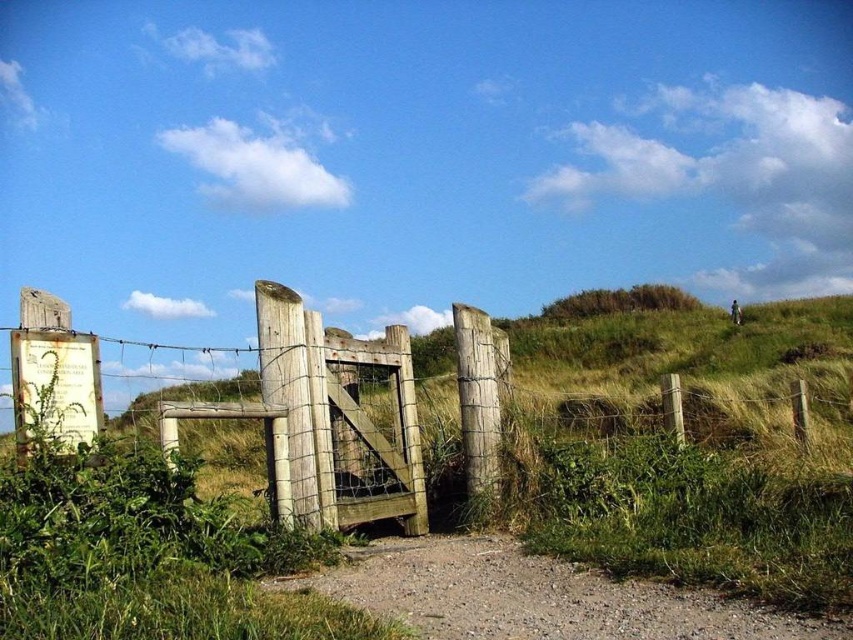
You are standing at the entrance of the rustic wooden gate and want to walk towards the point that is closer to you. Which point should you head towards, point [164,422] or point [425,598]?

You should head towards point [164,422] because it is closer to you than point [425,598].